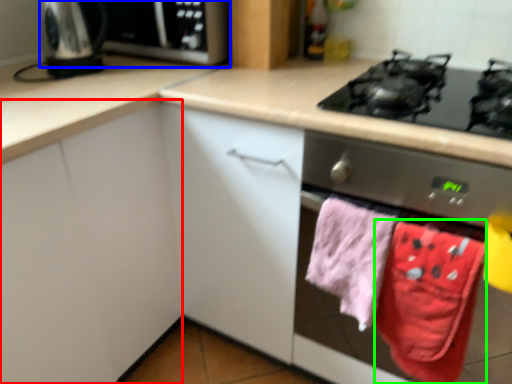
Question: Estimate the real-world distances between objects in this image. Which object is closer to cabinetry (highlighted by a red box), microwave (highlighted by a blue box) or beach towel (highlighted by a green box)?

Choices:
 (A) microwave
 (B) beach towel

Answer: (A)